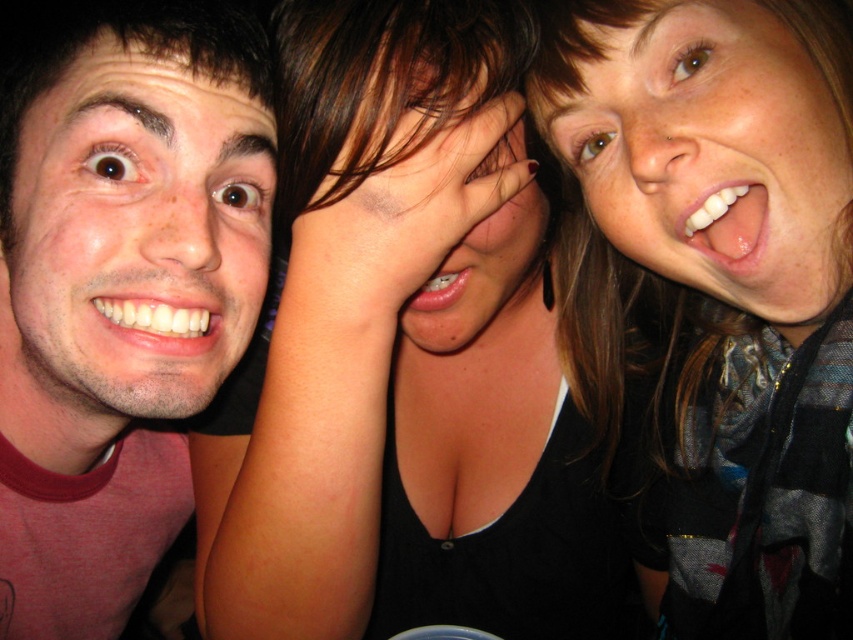
Question: Does matte skin face at left appear over matte skin at center?

Choices:
 (A) no
 (B) yes

Answer: (A)

Question: Which object appears farthest from the camera in this image?

Choices:
 (A) matte black tank top at center
 (B) smooth skin face at upper right
 (C) matte skin face at left
 (D) matte skin at center

Answer: (C)

Question: Which of the following is the farthest from the observer?

Choices:
 (A) pink glossy lips at center
 (B) matte skin face at left

Answer: (A)

Question: Does matte skin face at left appear over white glossy teeth at upper right?

Choices:
 (A) no
 (B) yes

Answer: (A)

Question: Is matte black tank top at center above matte skin at center?

Choices:
 (A) no
 (B) yes

Answer: (A)

Question: Which of the following is the closest to the observer?

Choices:
 (A) white glossy teeth at left
 (B) matte skin at center

Answer: (B)